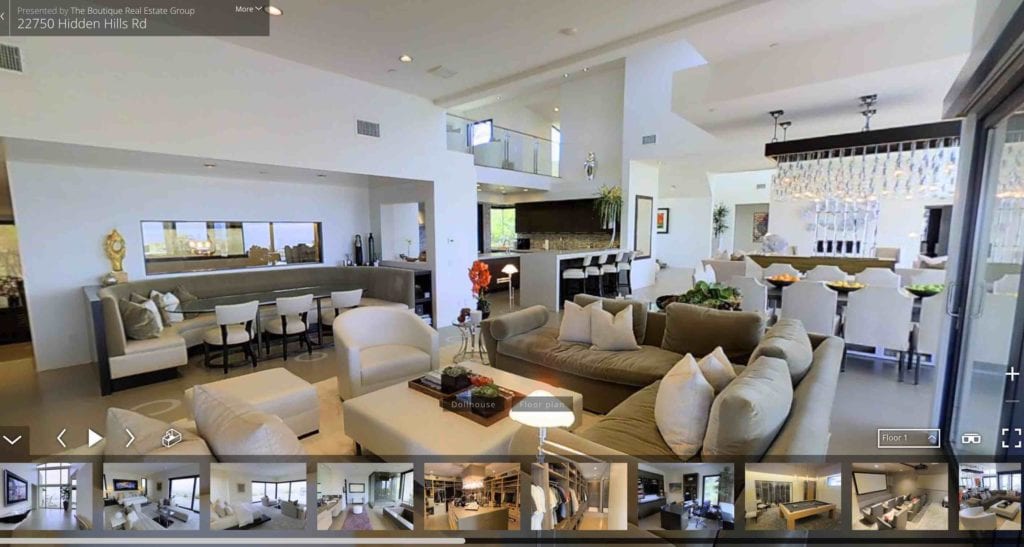
Locate an element on the screen. vent is located at coordinates (370, 131).